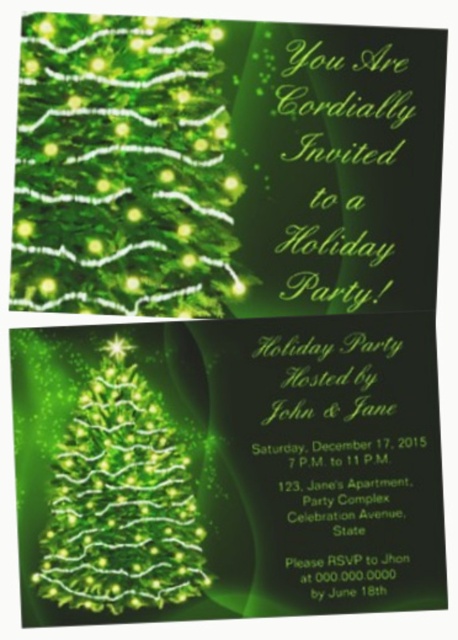
Who is more forward, (218, 220) or (191, 564)?

Point (191, 564) is more forward.

Can you confirm if green matte christmas tree at center is taller than green glittering christmas tree at center?

Correct, green matte christmas tree at center is much taller as green glittering christmas tree at center.

Does point (137, 124) come behind point (134, 419)?

No, it is in front of (134, 419).

Where is `green matte christmas tree at center`? green matte christmas tree at center is located at coordinates (124, 168).